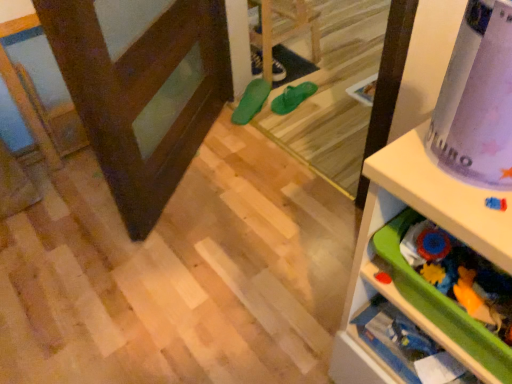
The height and width of the screenshot is (384, 512). Identify the location of empty space that is to the right of matte black shoe at center, the first footwear when ordered from back to front. (298, 67).